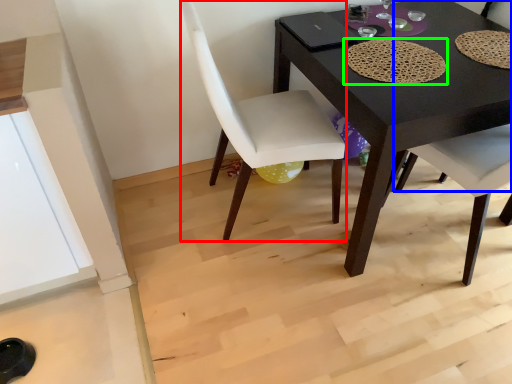
Question: Which object is positioned farthest from chair (highlighted by a red box)? Select from chair (highlighted by a blue box) and mat (highlighted by a green box).

Choices:
 (A) chair
 (B) mat

Answer: (A)